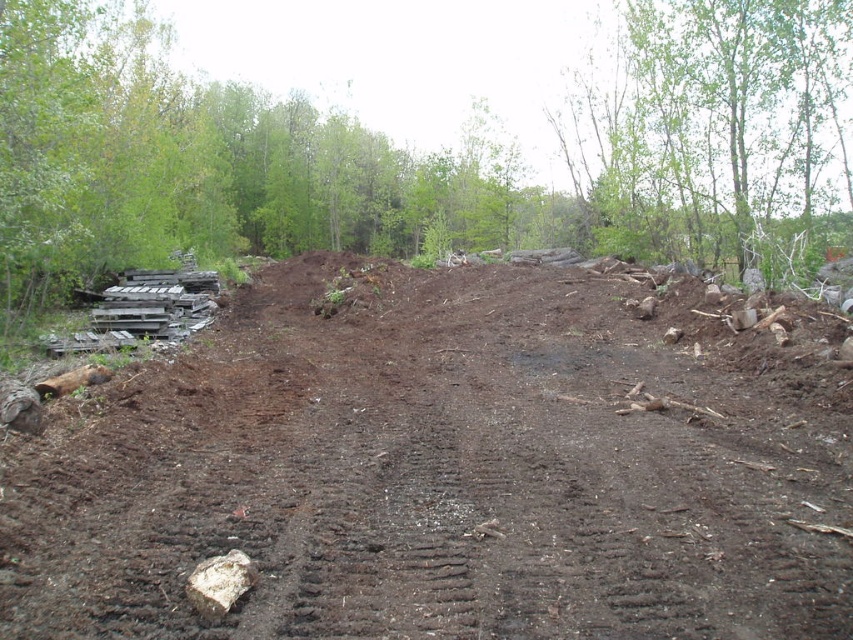
You are a worker at the construction site. You need to place a new tool box between the green leafy tree at upper right and the white rough rock at lower left. Is the vertical space between them sufficient to fit the tool box vertically?

The green leafy tree at upper right is above the white rough rock at lower left, so the vertical space between them is sufficient to fit the tool box vertically.

You are standing at the center of the disturbed soil area. Which direction should you walk to reach the green leafy tree at upper right?

The green leafy tree at upper right is located at point (712, 129), which is to the upper right direction from your current position at the center. Therefore, you should walk towards the upper right to reach it.

You are standing at the center of the disturbed soil area and want to walk towards the green leafy tree at upper right. Which direction should you turn to avoid the white rough rock at lower left?

You should turn to your right to head towards the green leafy tree at upper right, as it is located to the right of the white rough rock at lower left.